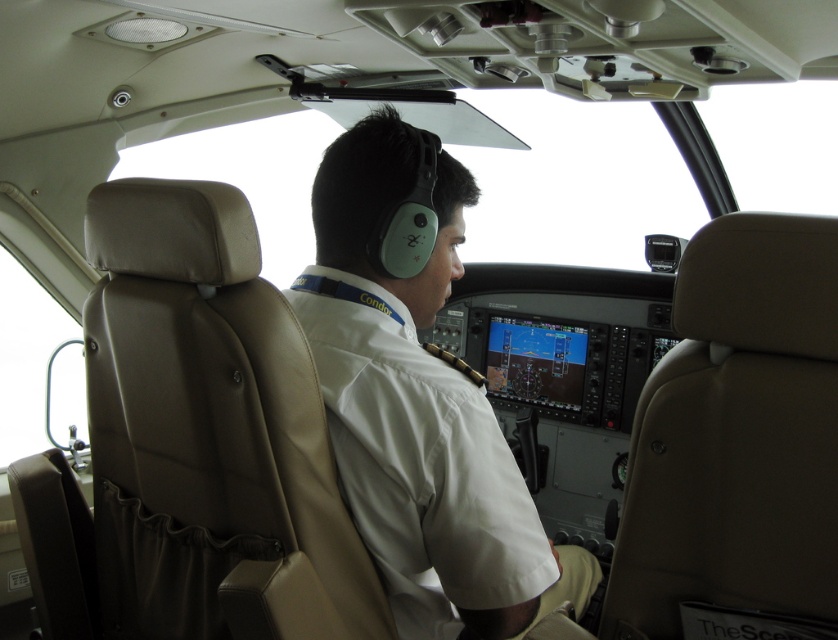
You are a passenger sitting in the aircraft cockpit. You notice two points marked in the cockpit. The first point is at coordinate point(200, 481) and the second point is at coordinate point(427, 310). From your perspective, which point is closer to you?

Point(200, 481) is in front of point(427, 310), so it is closer to you.

You are a passenger in the aircraft and want to move from your seat to the pilot. Which direction should you move relative to the leather seat at left and the white fabric pilot at center?

You should move to the right relative to the leather seat at left because it is to the left of the white fabric pilot at center.

You are a flight attendant checking the distance between the leather seat at left and the white fabric pilot at center. The airline requires that the distance between crew seats must be at least 9 inches for safety. Is the current distance compliant with the airline policy?

The leather seat at left is 8.98 inches away from the white fabric pilot at center. Since 8.98 inches is less than the required 9 inches, the distance does not comply with the airline policy.